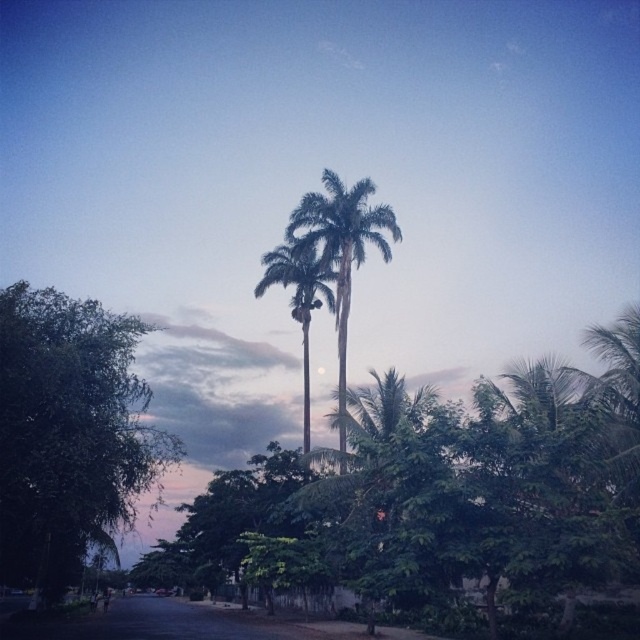
Question: Is green leafy tree at left in front of green leafy palm trees at center?

Choices:
 (A) no
 (B) yes

Answer: (B)

Question: In this image, where is green leafy tree at left located relative to green leafy palm tree at center?

Choices:
 (A) right
 (B) left

Answer: (B)

Question: Does green leafy palm trees at center have a lesser width compared to green leafy palm tree at center?

Choices:
 (A) yes
 (B) no

Answer: (B)

Question: Which point is farther from the camera taking this photo?

Choices:
 (A) (35, 554)
 (B) (301, 289)
 (C) (337, 340)

Answer: (C)

Question: Which object is positioned closest to the green leafy palm trees at center?

Choices:
 (A) green leafy tree at left
 (B) green leafy palm tree at center

Answer: (B)

Question: Which is nearer to the green leafy palm trees at center?

Choices:
 (A) green leafy palm tree at center
 (B) green leafy tree at left

Answer: (A)